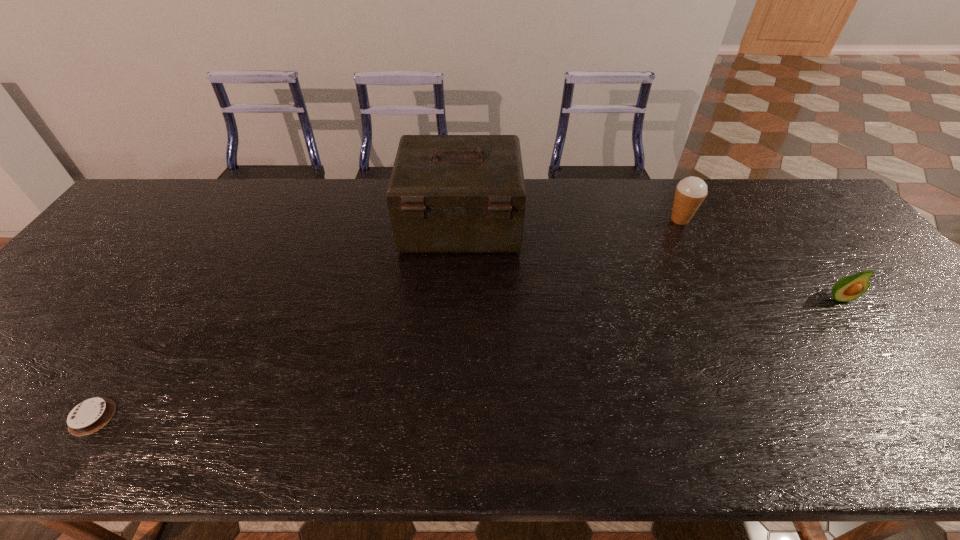
Where is `object that is the closest one to the leftmost object`? Image resolution: width=960 pixels, height=540 pixels. object that is the closest one to the leftmost object is located at coordinates (447, 193).

Where is `the third closest object to the chocolate cake`? The image size is (960, 540). the third closest object to the chocolate cake is located at coordinates (849, 288).

The width and height of the screenshot is (960, 540). Identify the location of free point that satisfies the following two spatial constraints: 1. on the back side of the leftmost object; 2. on the left side of the first-aid kit. (218, 224).